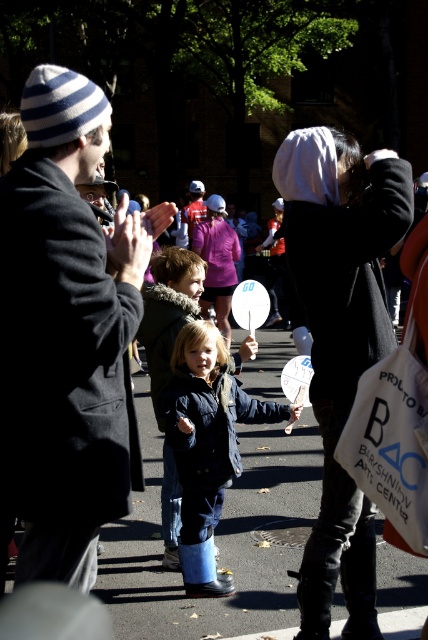
You are a photographer trying to capture a photo of both the black fabric coat at center and the dark blue denim jacket at center. Since you want them both in the frame, can you tell me which one is on the left so you can position your camera accordingly?

The dark blue denim jacket at center is on the left side of the black fabric coat at center, so you should position your camera to include both by focusing where they are aligned with the dark blue denim jacket at center on the left and the black fabric coat at center on the right.

You are standing on the sidewalk and see the striped knit hat at upper left and the dark blue jacket at center. Which object is closer to the left side of the street?

The striped knit hat at upper left is closer to the left side of the street because it is positioned to the left of the dark blue jacket at center.

You are standing at the edge of the crowd in the image and want to hand a flyer to both the person wearing the black fabric coat at center and the one in the dark blue denim jacket at center. If you can comfortably reach 3 feet, will you be able to hand both flyers without moving closer?

The black fabric coat at center is 3.36 feet from the dark blue denim jacket at center. Since your reach is 3 feet, you cannot comfortably hand both flyers without moving closer because the distance between them exceeds your reach.